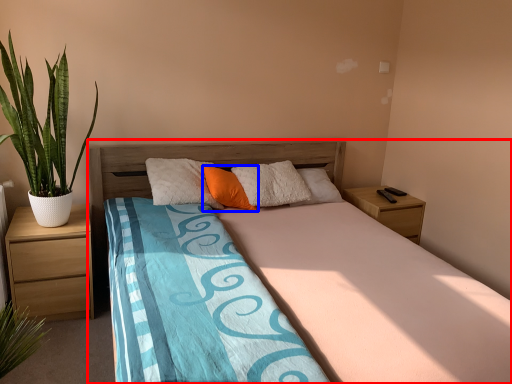
Question: Which object appears farthest to the camera in this image, bed (highlighted by a red box) or pillow (highlighted by a blue box)?

Choices:
 (A) bed
 (B) pillow

Answer: (B)